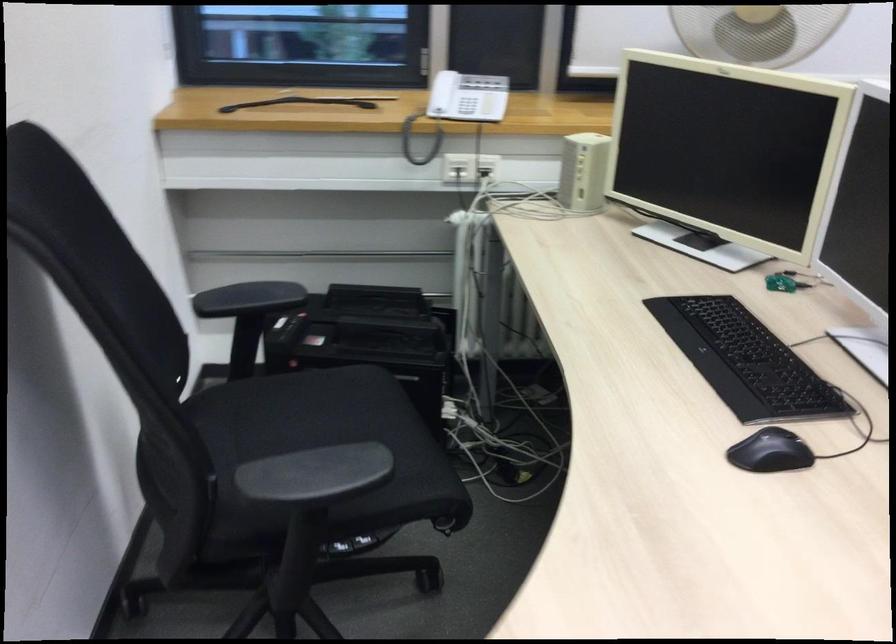
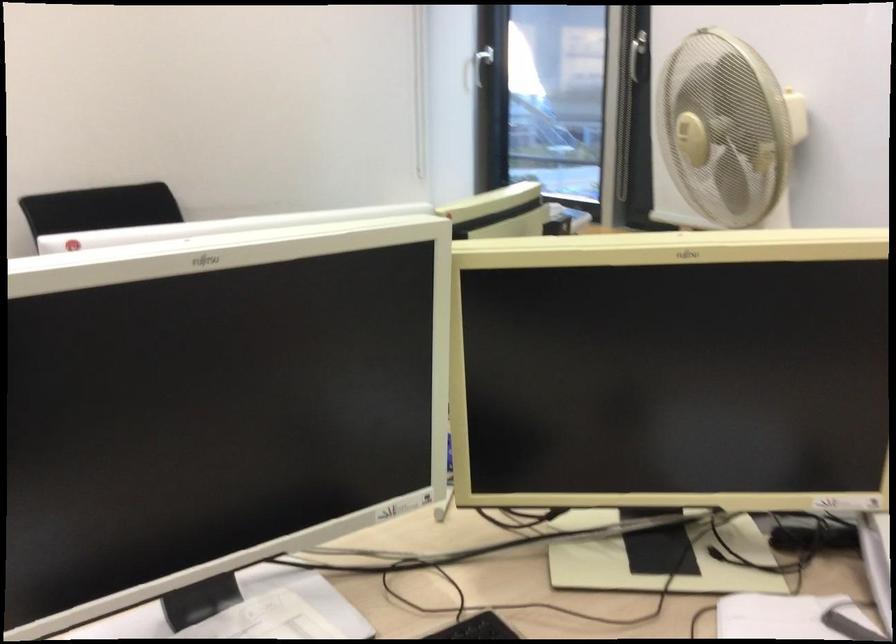
Question: I am providing you with two images of the same scene from different viewpoints. Which of the following objects are not visible in image2?

Choices:
 (A) black chair armrest
 (B) scanner lid
 (C) brass door knob
 (D) fan control knob

Answer: (A)